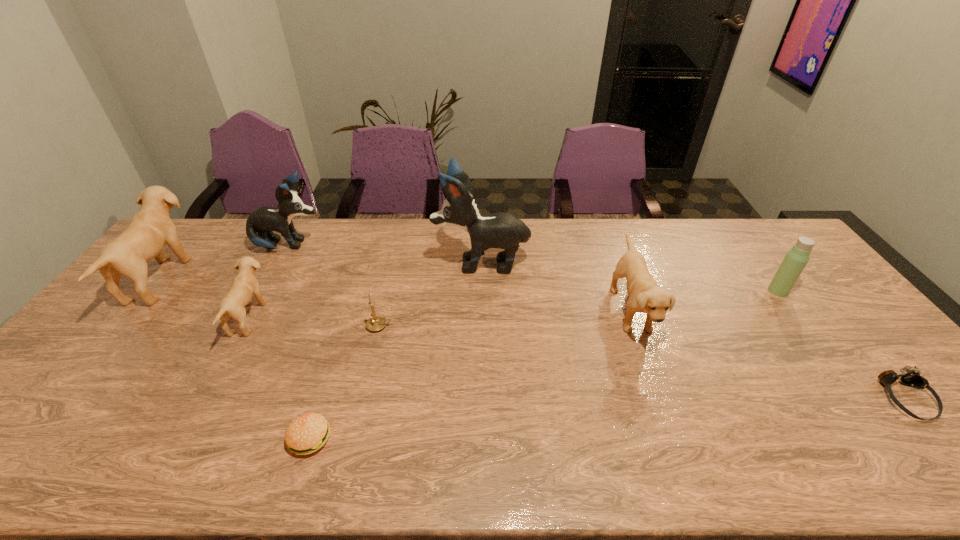
The width and height of the screenshot is (960, 540). Find the location of `the smallest beige puppy`. the smallest beige puppy is located at coordinates (244, 285).

The image size is (960, 540). What are the coordinates of `gold candle holder` in the screenshot? It's located at (376, 323).

Where is `candle holder`? candle holder is located at coordinates (376, 323).

I want to click on the rightmost object, so click(x=911, y=378).

This screenshot has width=960, height=540. Identify the location of bronze goggles. (911, 378).

Where is `the sixth object from right to left`? This screenshot has height=540, width=960. the sixth object from right to left is located at coordinates (307, 433).

At what (x,y) coordinates should I click in order to perform the action: click on brown patty. Please return your answer as a coordinate pair (x, y). The height and width of the screenshot is (540, 960). Looking at the image, I should click on (307, 433).

Where is `vacant area situated 0.280m on the front-facing side of the tallest puppy`? The image size is (960, 540). vacant area situated 0.280m on the front-facing side of the tallest puppy is located at coordinates (350, 262).

Where is `vacant point located on the front-facing side of the tallest puppy`? The height and width of the screenshot is (540, 960). vacant point located on the front-facing side of the tallest puppy is located at coordinates (413, 262).

Identify the location of vacant space situated 0.360m on the front-facing side of the tallest puppy. coord(326,262).